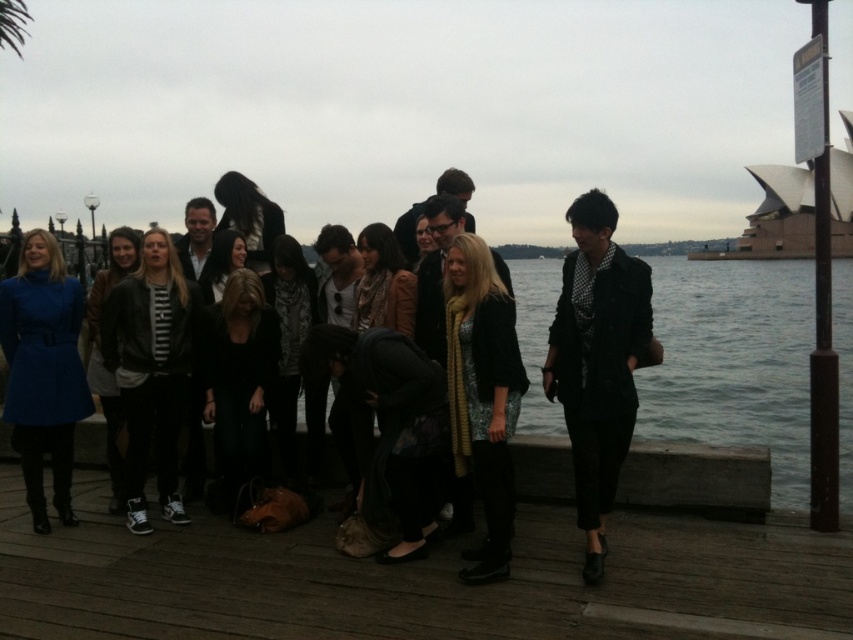
You are a photographer trying to capture a photo of the group. You notice two items at the center of the scene, the matte black blazer at center and the shiny gold scarf at center. Which item is positioned to the right side of the other?

The matte black blazer at center is to the right of the shiny gold scarf at center.

You are a photographer trying to capture the group of people on the wooden deck. You notice the clear water at center and the matte black blazer at center. Which object is positioned to the right of the other?

The clear water at center is to the right of the matte black blazer at center.

You are a photographer trying to frame two central items in a group photo. The matte black blazer at center and the shiny gold scarf at center are both in the shot. Which item takes up more horizontal space in the photo?

The matte black blazer at center takes up more horizontal space in the photo since its width surpasses that of the shiny gold scarf at center.